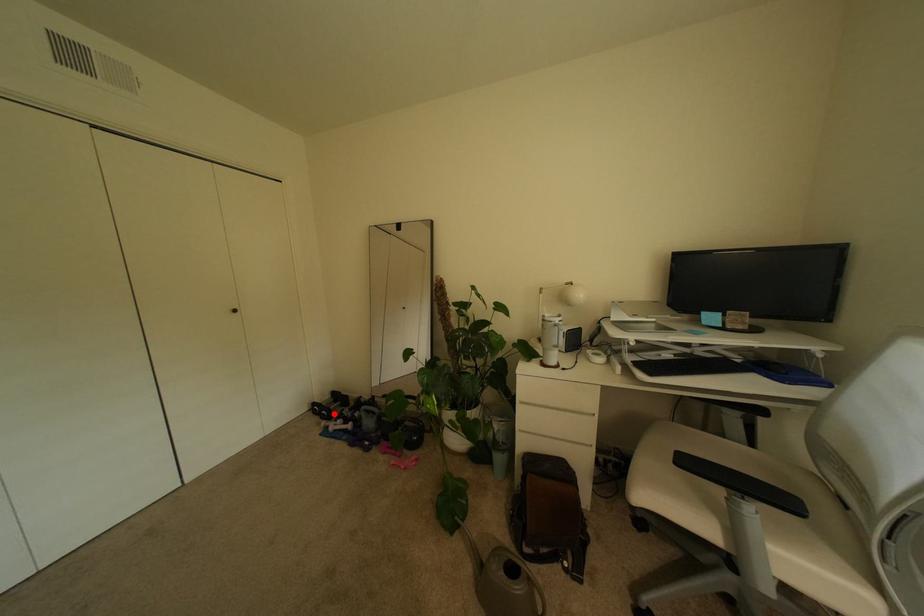
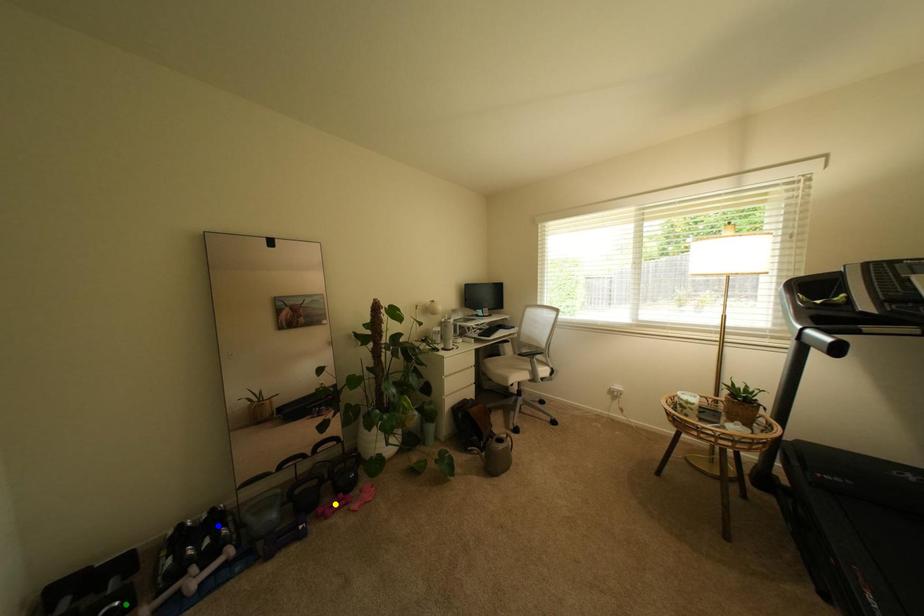
Question: I am providing you with two images of the same scene from different viewpoints. A red point is marked on the first image. You are given multiple points on the second image. Which point in image 2 represents the same 3d spot as the red point in image 1?

Choices:
 (A) green point
 (B) blue point
 (C) yellow point

Answer: (A)